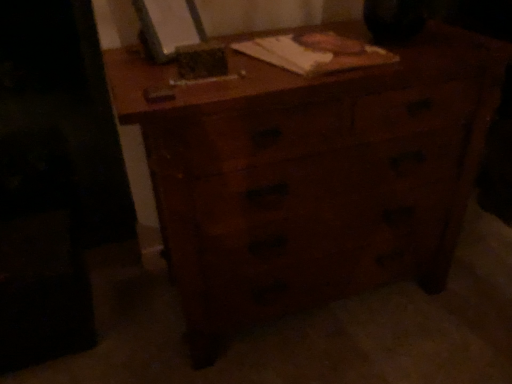
Where is `free point behind wooden notebook at center`? The width and height of the screenshot is (512, 384). free point behind wooden notebook at center is located at coordinates (306, 34).